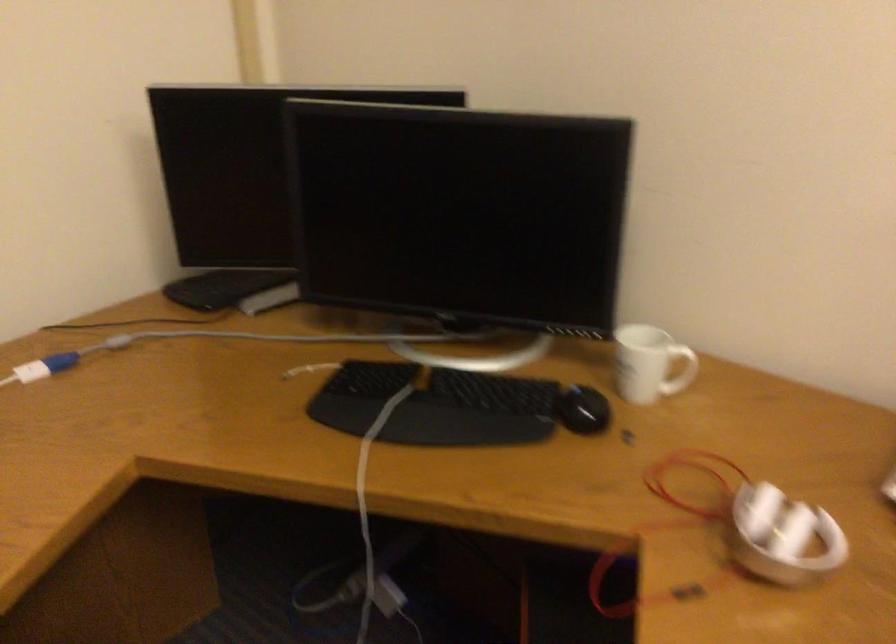
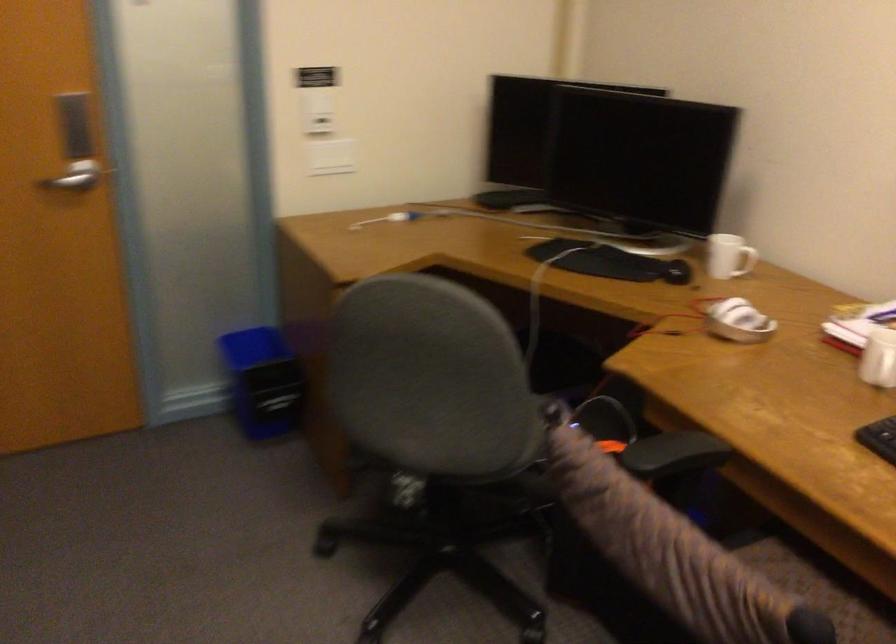
In the second image, find the point that corresponds to [664,368] in the first image.

(745, 261)